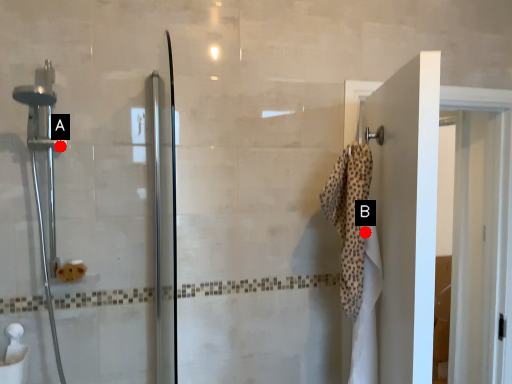
Question: Two points are circled on the image, labeled by A and B beside each circle. Which point is closer to the camera?

Choices:
 (A) A is closer
 (B) B is closer

Answer: (B)